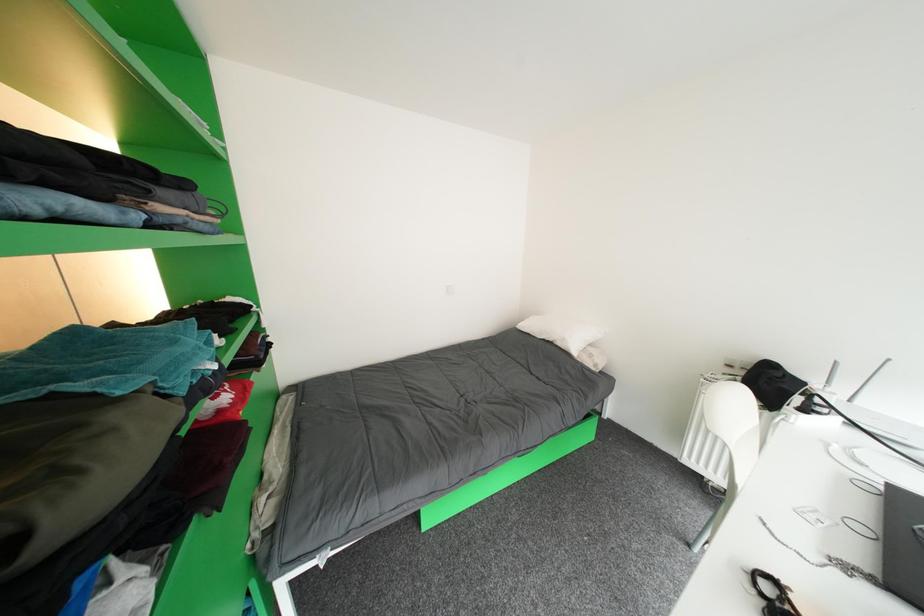
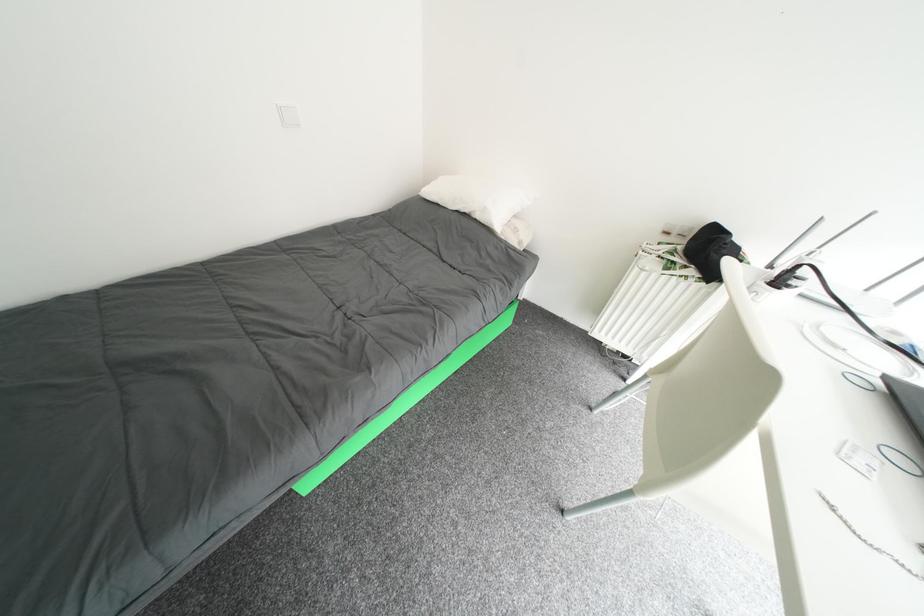
First-person continuous shooting, in which direction is the camera rotating?

The camera's rotation is toward right-down.